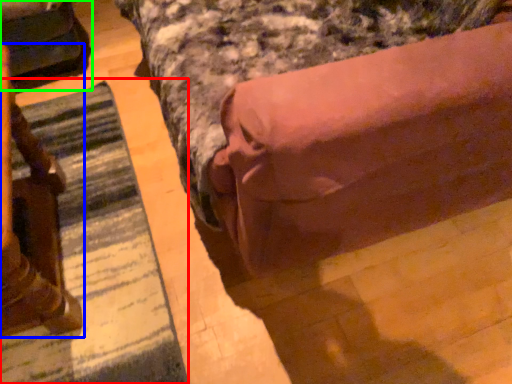
Question: Which is nearer to the mat (highlighted by a red box)? furniture (highlighted by a blue box) or swivel chair (highlighted by a green box).

Choices:
 (A) furniture
 (B) swivel chair

Answer: (A)